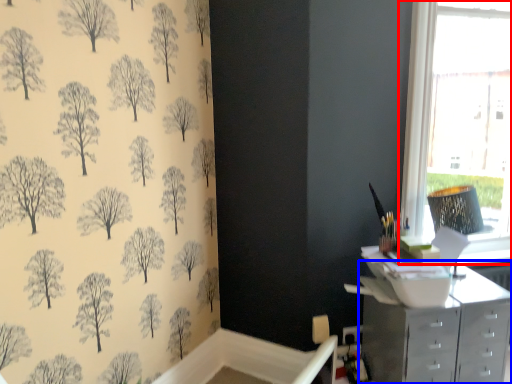
Question: Which of the following is the closest to the observer, window (highlighted by a red box) or chest of drawers (highlighted by a blue box)?

Choices:
 (A) window
 (B) chest of drawers

Answer: (B)